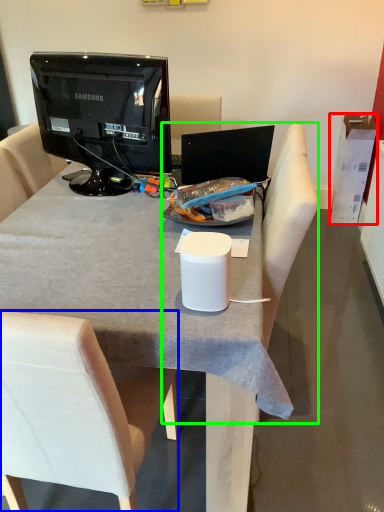
Question: Which is farther away from box (highlighted by a red box)? chair (highlighted by a blue box) or armchair (highlighted by a green box)?

Choices:
 (A) chair
 (B) armchair

Answer: (A)